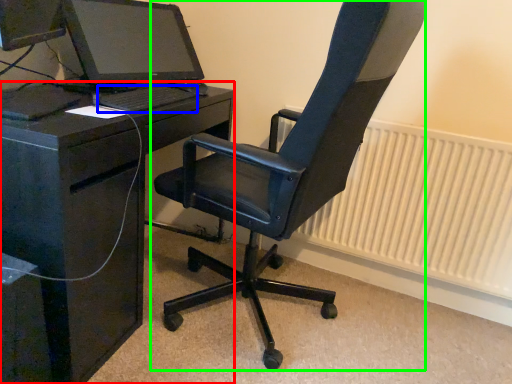
Question: Which object is positioned closest to desk (highlighted by a red box)? Select from computer keyboard (highlighted by a blue box) and chair (highlighted by a green box).

Choices:
 (A) computer keyboard
 (B) chair

Answer: (A)